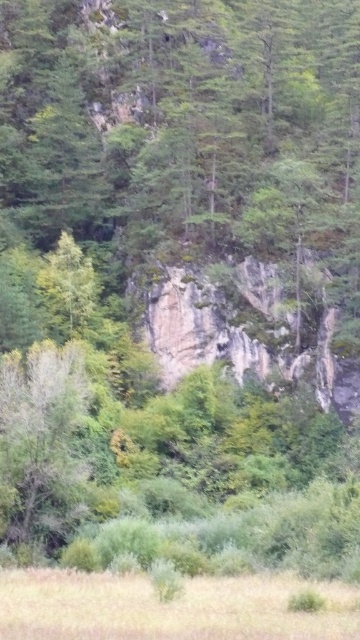
You are standing at point (42, 440) in the landscape. What object is located at your current position?

The green matte tree at lower left is located at point (42, 440).

You are a hiker trying to navigate through the dry grass at lower center and the green matte tree at center. Which of these two objects is shorter in height?

The dry grass at lower center is shorter than the green matte tree at center.